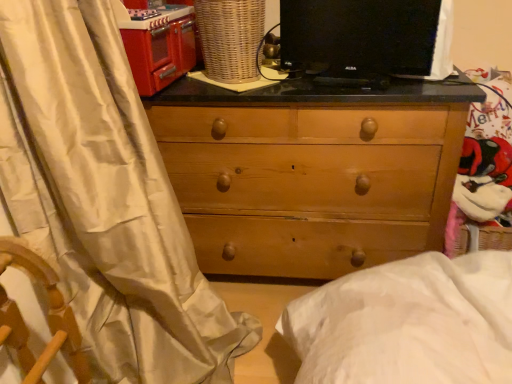
What do you see at coordinates (311, 172) in the screenshot?
I see `natural wood chest of drawers at center` at bounding box center [311, 172].

What do you see at coordinates (105, 200) in the screenshot?
I see `white satin curtain at left` at bounding box center [105, 200].

What do you see at coordinates (230, 38) in the screenshot?
I see `woven brown basket at upper center` at bounding box center [230, 38].

Where is `shiny red oven at upper left`? shiny red oven at upper left is located at coordinates (160, 48).

Identify the location of natural wood chest of drawers at center. (311, 172).

Locate an element on the screen. appliance in front of the woven brown basket at upper center is located at coordinates (160, 48).

How many degrees apart are the facing directions of shiny red oven at upper left and woven brown basket at upper center?

The angular difference between shiny red oven at upper left and woven brown basket at upper center is 90 degrees.

Is shiny red oven at upper left in front of woven brown basket at upper center?

Yes.

From the image's perspective, which one is positioned higher, shiny red oven at upper left or woven brown basket at upper center?

woven brown basket at upper center, from the image's perspective.

From a real-world perspective, is white satin curtain at left located higher than woven brown basket at upper center?

No, from a real-world perspective, white satin curtain at left is not on top of woven brown basket at upper center.

In the image, is white satin curtain at left positioned in front of or behind woven brown basket at upper center?

white satin curtain at left is positioned closer to the viewer than woven brown basket at upper center.

Is white satin curtain at left situated inside woven brown basket at upper center or outside?

white satin curtain at left exists outside the volume of woven brown basket at upper center.

Which of these two, shiny red oven at upper left or black glossy monitor at upper center, is wider?

shiny red oven at upper left.

Which is behind, shiny red oven at upper left or black glossy monitor at upper center?

shiny red oven at upper left is behind.

Can you tell me how much shiny red oven at upper left and black glossy monitor at upper center differ in facing direction?

There is a 103-degree angle between the facing directions of shiny red oven at upper left and black glossy monitor at upper center.

Considering the sizes of shiny red oven at upper left and black glossy monitor at upper center in the image, is shiny red oven at upper left bigger or smaller than black glossy monitor at upper center?

Clearly, shiny red oven at upper left is larger in size than black glossy monitor at upper center.

Is white satin curtain at left at the back of black glossy monitor at upper center?

That's not correct — black glossy monitor at upper center is not looking away from white satin curtain at left.

How different are the orientations of black glossy monitor at upper center and white satin curtain at left in degrees?

The angular difference between black glossy monitor at upper center and white satin curtain at left is 106 degrees.

Which is more to the left, black glossy monitor at upper center or white satin curtain at left?

Positioned to the left is white satin curtain at left.

Does natural wood chest of drawers at center appear on the left side of woven brown basket at upper center?

Incorrect, natural wood chest of drawers at center is not on the left side of woven brown basket at upper center.

Which object is more forward, natural wood chest of drawers at center or woven brown basket at upper center?

natural wood chest of drawers at center is more forward.

Does point (166, 141) lie in front of point (232, 79)?

No, it is behind (232, 79).

From a real-world perspective, is woven brown basket at upper center over white satin curtain at left?

Yes.

Identify the location of curtain on the left of woven brown basket at upper center. The width and height of the screenshot is (512, 384). (105, 200).

Is woven brown basket at upper center looking in the opposite direction of white satin curtain at left?

No, white satin curtain at left is not at the back of woven brown basket at upper center.

Which object is thinner, woven brown basket at upper center or white satin curtain at left?

Thinner between the two is woven brown basket at upper center.

From a real-world perspective, is white satin curtain at left below natural wood chest of drawers at center?

No, from a real-world perspective, white satin curtain at left is not beneath natural wood chest of drawers at center.

From the picture: Between white satin curtain at left and natural wood chest of drawers at center, which one has larger width?

natural wood chest of drawers at center is wider.

How far apart are white satin curtain at left and natural wood chest of drawers at center?

white satin curtain at left is 18.55 inches away from natural wood chest of drawers at center.

Looking at this image, considering the sizes of objects white satin curtain at left and natural wood chest of drawers at center in the image provided, who is shorter, white satin curtain at left or natural wood chest of drawers at center?

Standing shorter between the two is natural wood chest of drawers at center.

Where is `basket on the right of shiny red oven at upper left`? This screenshot has width=512, height=384. basket on the right of shiny red oven at upper left is located at coordinates (230, 38).

Locate an element on the screen. This screenshot has width=512, height=384. curtain located on the left of woven brown basket at upper center is located at coordinates (105, 200).

From the image, which object appears to be nearer to black glossy monitor at upper center, woven brown basket at upper center or white satin curtain at left?

The object closer to black glossy monitor at upper center is woven brown basket at upper center.

Based on their spatial positions, is black glossy monitor at upper center or shiny red oven at upper left closer to white satin curtain at left?

The object closer to white satin curtain at left is shiny red oven at upper left.

From the image, which object appears to be farther from shiny red oven at upper left, natural wood chest of drawers at center or white satin curtain at left?

Among the two, white satin curtain at left is located further to shiny red oven at upper left.

Considering their positions, is black glossy monitor at upper center positioned further to natural wood chest of drawers at center than woven brown basket at upper center?

woven brown basket at upper center lies further to natural wood chest of drawers at center than the other object.

Looking at the image, which one is located closer to shiny red oven at upper left, woven brown basket at upper center or white satin curtain at left?

woven brown basket at upper center.

Which object lies nearer to the anchor point natural wood chest of drawers at center, shiny red oven at upper left or black glossy monitor at upper center?

Among the two, black glossy monitor at upper center is located nearer to natural wood chest of drawers at center.

Consider the image. Estimate the real-world distances between objects in this image. Which object is further from white satin curtain at left, black glossy monitor at upper center or woven brown basket at upper center?

Based on the image, black glossy monitor at upper center appears to be further to white satin curtain at left.

From the image, which object appears to be nearer to woven brown basket at upper center, shiny red oven at upper left or white satin curtain at left?

shiny red oven at upper left is positioned closer to the anchor woven brown basket at upper center.

Find the location of a particular element. chest of drawers between white satin curtain at left and woven brown basket at upper center along the z-axis is located at coordinates (311, 172).

You are a GUI agent. You are given a task and a screenshot of the screen. Output one action in this format:
    pyautogui.click(x=<x>, y=<y>)
    Task: Click on the appliance between woven brown basket at upper center and white satin curtain at left from top to bottom
    
    Given the screenshot: What is the action you would take?
    pyautogui.click(x=160, y=48)

Where is `curtain between shiny red oven at upper left and black glossy monitor at upper center`? curtain between shiny red oven at upper left and black glossy monitor at upper center is located at coordinates click(x=105, y=200).

At what (x,y) coordinates should I click in order to perform the action: click on basket located between shiny red oven at upper left and black glossy monitor at upper center in the left-right direction. Please return your answer as a coordinate pair (x, y). Looking at the image, I should click on coord(230,38).